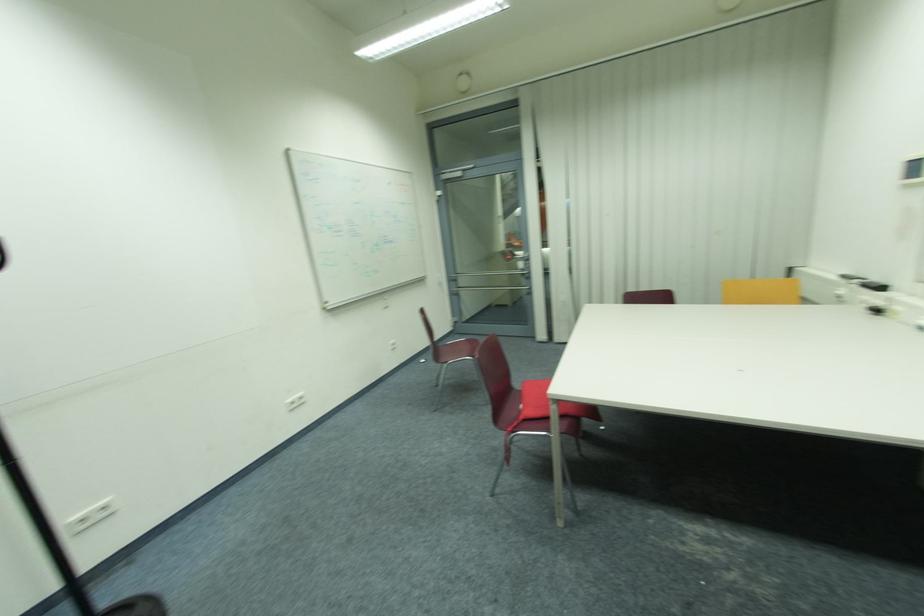
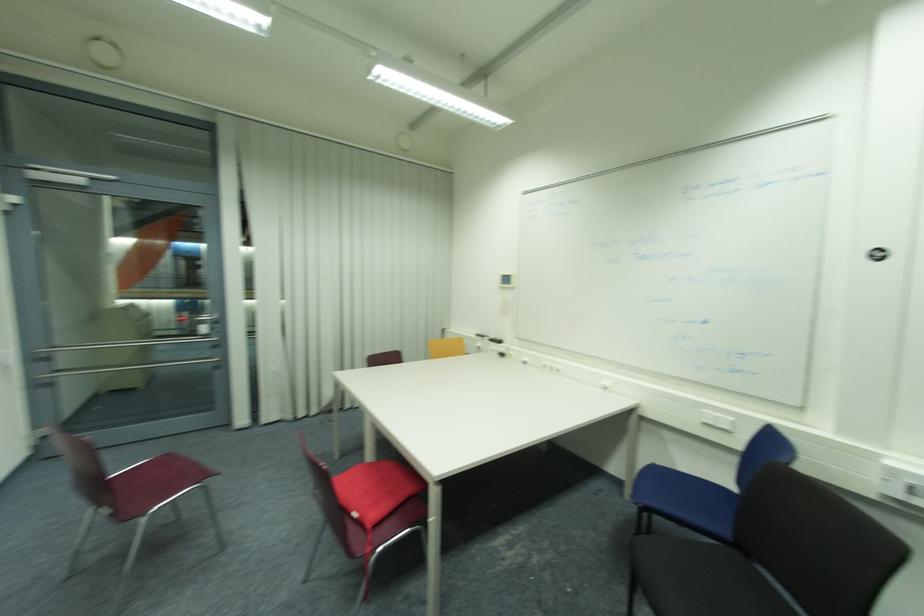
Where in the second image is the point corresponding to the point at 535,413 from the first image?

(377, 519)